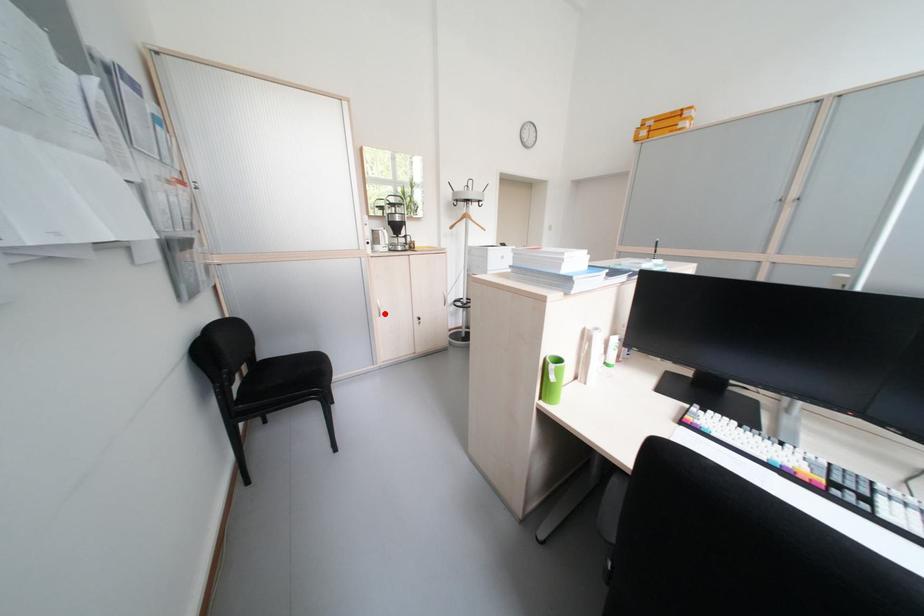
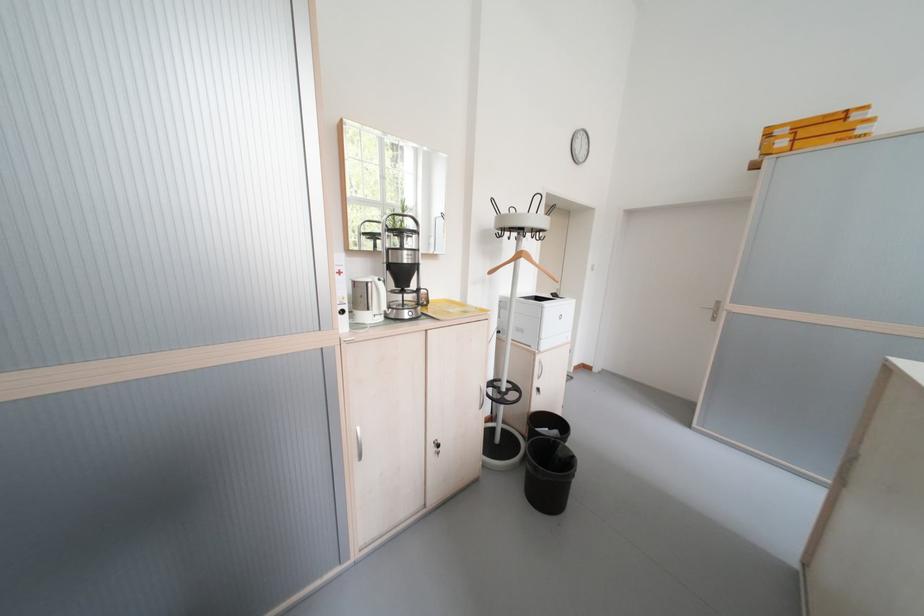
In the second image, find the point that corresponds to the highlighted location in the first image.

(359, 455)